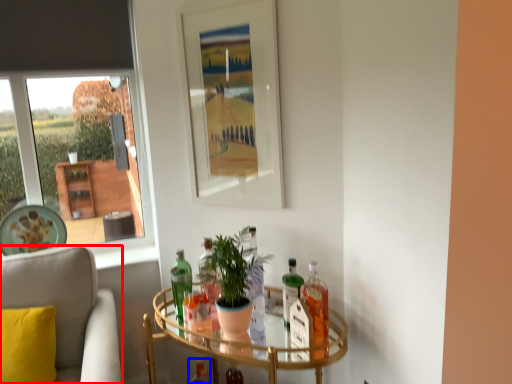
Question: Which object is further to the camera taking this photo, chair (highlighted by a red box) or bottle (highlighted by a blue box)?

Choices:
 (A) chair
 (B) bottle

Answer: (B)